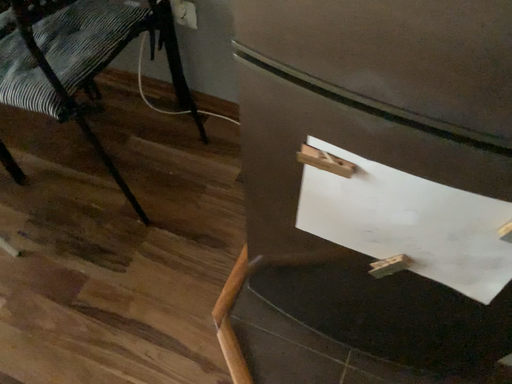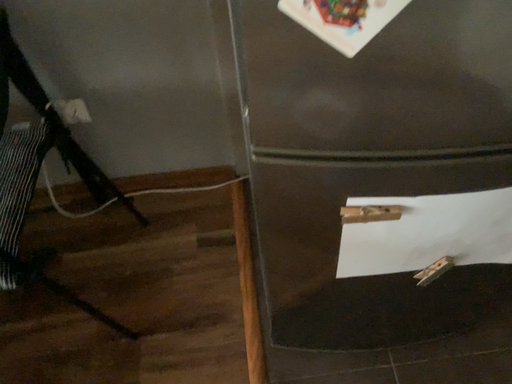
Question: How did the camera likely rotate when shooting the video?

Choices:
 (A) rotated right
 (B) rotated left

Answer: (A)